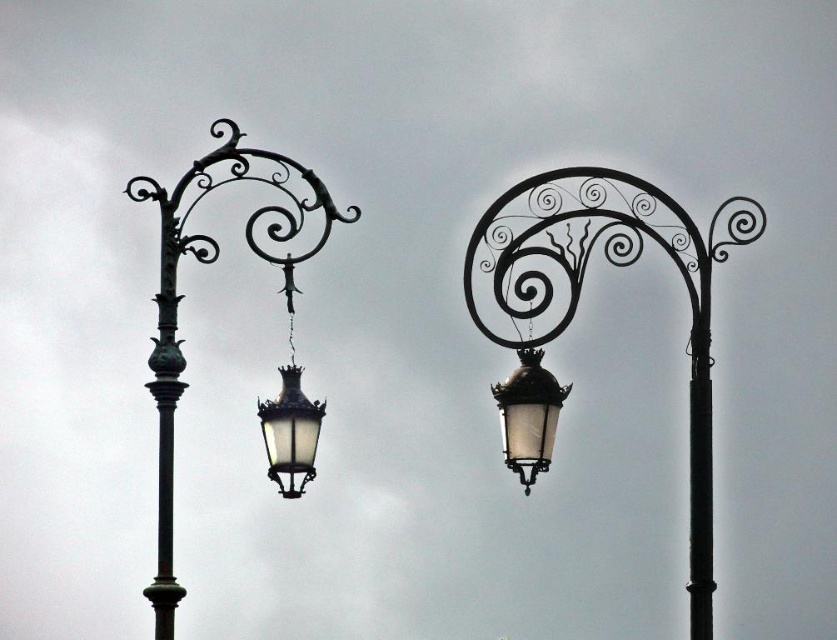
Question: Which point is farther to the camera?

Choices:
 (A) (175, 337)
 (B) (566, 396)
 (C) (146, 588)

Answer: (B)

Question: Can you confirm if polished brass street light at left is positioned to the right of matte glass lantern at center?

Choices:
 (A) no
 (B) yes

Answer: (A)

Question: Is black metal pole at right smaller than matte black lantern at center?

Choices:
 (A) yes
 (B) no

Answer: (B)

Question: Does matte black street light at center appear under matte black lantern at center?

Choices:
 (A) no
 (B) yes

Answer: (B)

Question: Which of these objects is positioned closest to the polished bronze pole at left?

Choices:
 (A) black metal pole at right
 (B) matte glass lantern at center

Answer: (B)

Question: Which point is closer to the camera?

Choices:
 (A) (235, 128)
 (B) (709, 346)
 (C) (533, 435)

Answer: (C)